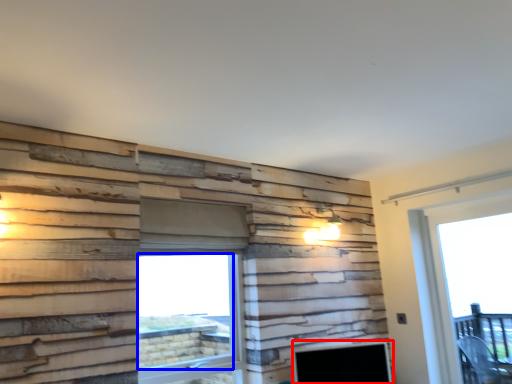
Question: Which point is closer to the camera, fireplace (highlighted by a red box) or window screen (highlighted by a blue box)?

Choices:
 (A) fireplace
 (B) window screen

Answer: (B)